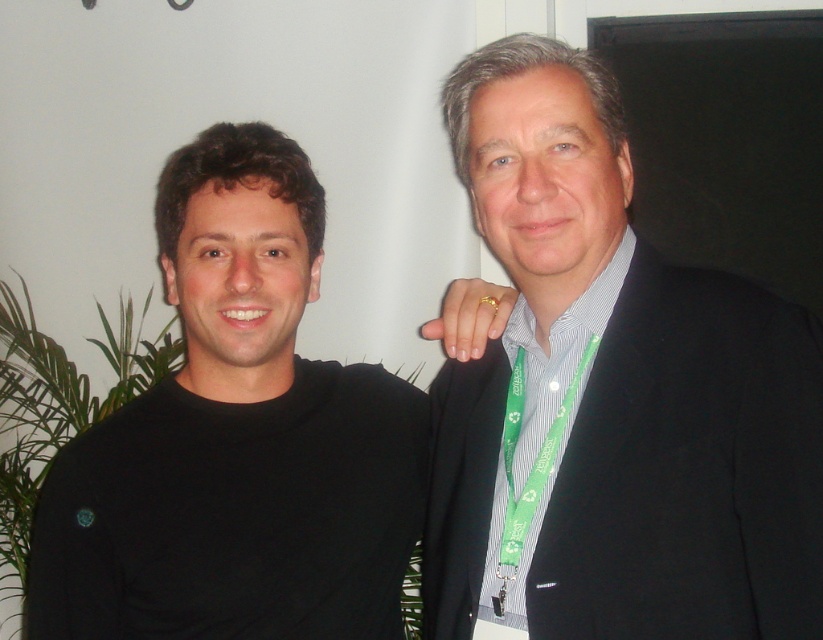
Locate an element on the screen. Image resolution: width=823 pixels, height=640 pixels. black matte shirt at left is located at coordinates (236, 440).

Describe the element at coordinates (236, 440) in the screenshot. I see `black matte shirt at left` at that location.

Who is more forward, (319, 584) or (487, 474)?

Positioned in front is point (487, 474).

I want to click on black matte shirt at left, so click(236, 440).